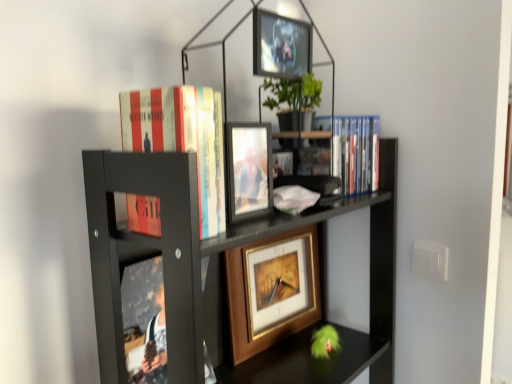
Question: Is blue plastic dvds at upper right, which is the second book from left to right, inside the boundaries of hardcover book at upper center, the second book positioned from the back, or outside?

Choices:
 (A) inside
 (B) outside

Answer: (B)

Question: Is blue plastic dvds at upper right, placed as the second book when sorted from front to back, bigger or smaller than hardcover book at upper center, which is the 1th book in front-to-back order?

Choices:
 (A) small
 (B) big

Answer: (A)

Question: Which object is positioned farthest from the hardcover book at upper center, which ranks as the 1th book in left-to-right order?

Choices:
 (A) metallic silver picture frame at upper center, which is counted as the 1th picture frame, starting from the top
 (B) black matte bookcase at upper center
 (C) matte glass photo frame at center, positioned as the 3th picture frame in back-to-front order
 (D) gold-framed picture at center, the 3th picture frame in the front-to-back sequence
 (E) blue plastic dvds at upper right, placed as the first book when sorted from back to front

Answer: (D)

Question: Which object is positioned closest to the metallic silver picture frame at upper center, which is the 2th picture frame in back-to-front order?

Choices:
 (A) matte glass photo frame at center, the second picture frame when ordered from top to bottom
 (B) hardcover book at upper center, the 2th book viewed from the right
 (C) blue plastic dvds at upper right, which is the second book from left to right
 (D) black matte bookcase at upper center
 (E) gold-framed picture at center, the 3th picture frame in the front-to-back sequence

Answer: (A)